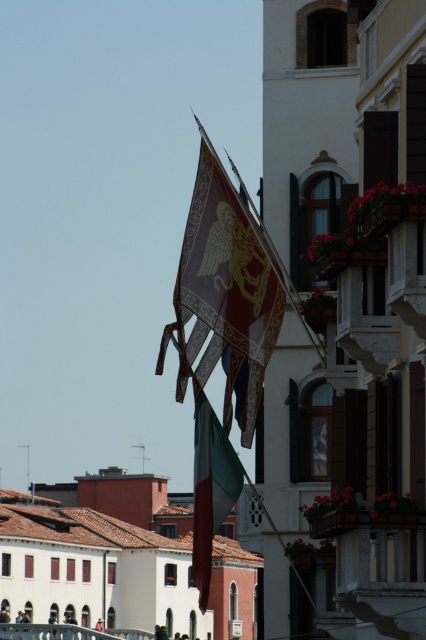
You are a tourist standing in front of the building with the ornate flags. You want to take a photo of the metallic gold flag at center. Where should you position yourself to capture the flag in the center of your camera viewfinder?

The metallic gold flag at center is located at coordinates approximately 0.466 on the x axis and 0.526 on the y axis, so you should position yourself directly in front of the flag at those coordinates to center it in your camera viewfinder.

You are standing in the square and want to take a photo of the point at coordinates (181,326). The camera you are using has a focal length of 50mm and a sensor size of 24mm x 36mm. If the point is 86.74 meters away, what is the angle of view required to capture the point in the frame?

The point at coordinates (181,326) is 86.74 meters from the camera. To calculate the angle of view, use the formula angle of view in radians equals arctangent of sensor dimension divided by twice the distance. Using the sensor width of 36mm, the angle of view would be arctangent of 36 divided by 2 times 86.74 meters. This results in an angle of approximately 0.0021 radians, which is about 0.12 degrees. Since most cameras have a wider angle of view than this, the point should be within the frame.